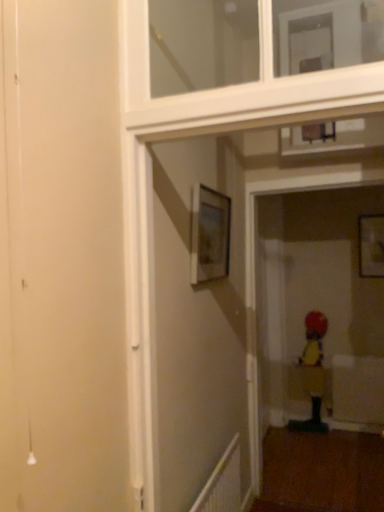
Question: Is white glossy window frame at upper center at the right side of matte wooden picture frame at upper right, the first picture frame from the back?

Choices:
 (A) yes
 (B) no

Answer: (B)

Question: Is matte wooden picture frame at upper right, the first picture frame from the back, located within white glossy window frame at upper center?

Choices:
 (A) no
 (B) yes

Answer: (A)

Question: Is the depth of white glossy window frame at upper center greater than that of matte wooden picture frame at upper right, placed as the 1th picture frame when sorted from right to left?

Choices:
 (A) no
 (B) yes

Answer: (A)

Question: Is white glossy window frame at upper center wider than matte wooden picture frame at upper right, placed as the 1th picture frame when sorted from right to left?

Choices:
 (A) yes
 (B) no

Answer: (A)

Question: Can you confirm if white glossy window frame at upper center is bigger than matte wooden picture frame at upper right, the first picture frame from the back?

Choices:
 (A) yes
 (B) no

Answer: (A)

Question: From a real-world perspective, is white glossy window frame at upper center on matte wooden picture frame at upper right, which is the 2th picture frame from front to back?

Choices:
 (A) yes
 (B) no

Answer: (A)

Question: Is yellow fabric child at lower right at the left side of matte wooden picture frame at upper center, which is the first picture frame in front-to-back order?

Choices:
 (A) yes
 (B) no

Answer: (B)

Question: Could you tell me if yellow fabric child at lower right is facing matte wooden picture frame at upper center, which ranks as the 1th picture frame in left-to-right order?

Choices:
 (A) no
 (B) yes

Answer: (B)

Question: Considering the relative sizes of yellow fabric child at lower right and matte wooden picture frame at upper center, the 2th picture frame when ordered from right to left, in the image provided, is yellow fabric child at lower right shorter than matte wooden picture frame at upper center, the 2th picture frame when ordered from right to left,?

Choices:
 (A) no
 (B) yes

Answer: (A)

Question: Is yellow fabric child at lower right beside matte wooden picture frame at upper center, which is the first picture frame in front-to-back order?

Choices:
 (A) yes
 (B) no

Answer: (B)

Question: Does yellow fabric child at lower right have a greater width compared to matte wooden picture frame at upper center, which is the first picture frame in front-to-back order?

Choices:
 (A) yes
 (B) no

Answer: (A)

Question: Is matte wooden picture frame at upper center, the 2th picture frame when ordered from right to left, inside yellow fabric child at lower right?

Choices:
 (A) no
 (B) yes

Answer: (A)

Question: From a real-world perspective, is white plastic radiator at lower right physically above white glossy window frame at upper center?

Choices:
 (A) no
 (B) yes

Answer: (A)